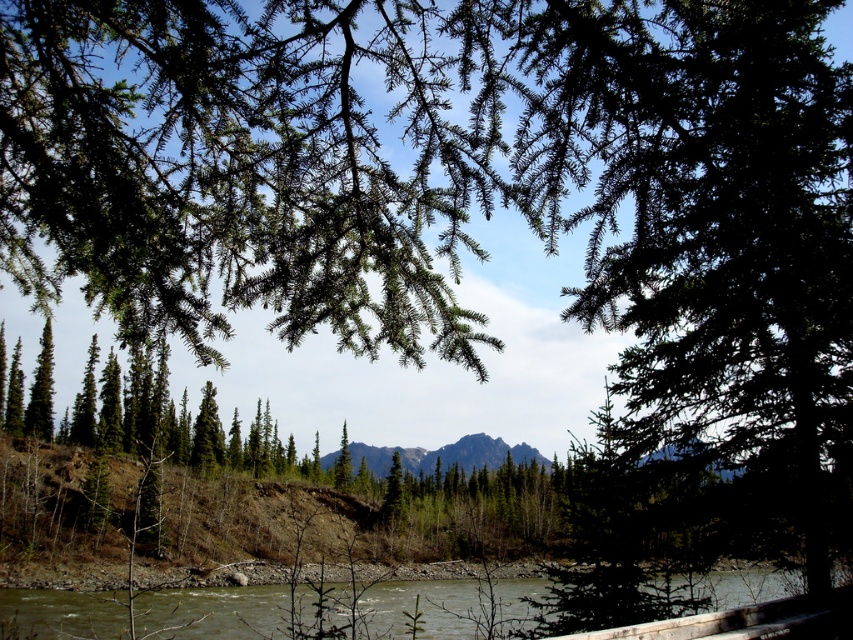
Question: Does brown gravel river at lower center appear under green matte evergreen tree at lower left?

Choices:
 (A) no
 (B) yes

Answer: (B)

Question: Which is farther from the green matte tree at center?

Choices:
 (A) rugged granite mountain at center
 (B) green matte evergreen tree at lower left

Answer: (B)

Question: Is green matte evergreen tree at lower left wider than green matte tree at center?

Choices:
 (A) yes
 (B) no

Answer: (A)

Question: Which of the following is the closest to the observer?

Choices:
 (A) green matte tree at center
 (B) brown gravel river at lower center
 (C) rugged granite mountain at center
 (D) green matte evergreen tree at lower left

Answer: (B)

Question: Does brown gravel river at lower center have a smaller size compared to green matte evergreen tree at lower left?

Choices:
 (A) yes
 (B) no

Answer: (B)

Question: Which point is farther to the camera?

Choices:
 (A) brown gravel river at lower center
 (B) green matte tree at center
 (C) green matte evergreen tree at lower left

Answer: (B)